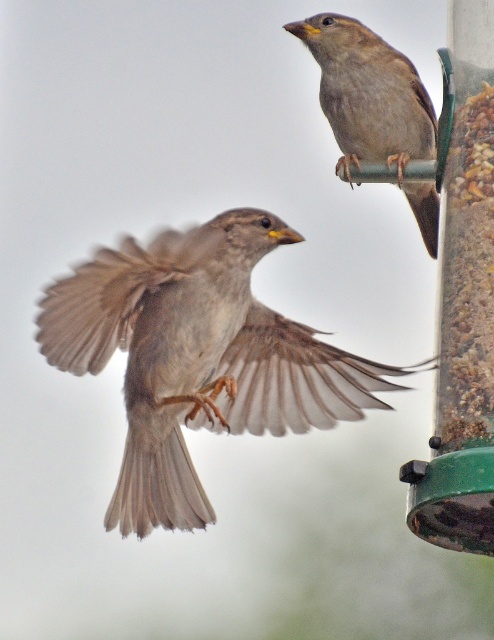
You are standing in a park and see the brown feathered sparrow at center. If you want to observe it closely without disturbing it, what is the minimum safe distance you should maintain?

The minimum safe distance to maintain is 6.52 feet to avoid disturbing the brown feathered sparrow at center.

You are a birdwatcher trying to identify the position of the brown feathered sparrow at center in the image. The image has a coordinate system where the bottom left corner is the origin. Can you determine if the brown feathered sparrow at center is located to the left or right of the point with coordinates point [198,356]?

The point [198,356] corresponds exactly to the location of the brown feathered sparrow at center, so it is precisely at that coordinate.

You are a birdwatcher observing the two brown feathered sparrows in the image. Which sparrow, the brown feathered sparrow at center or the brown feathered sparrow at upper right, is positioned more to the left side of the frame?

The brown feathered sparrow at center is positioned more to the left side of the frame compared to the brown feathered sparrow at upper right.